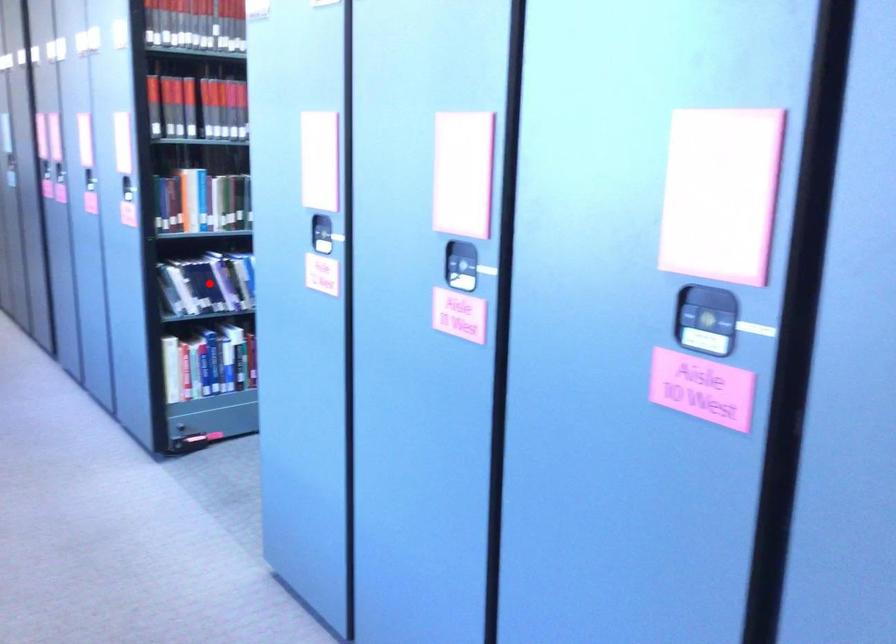
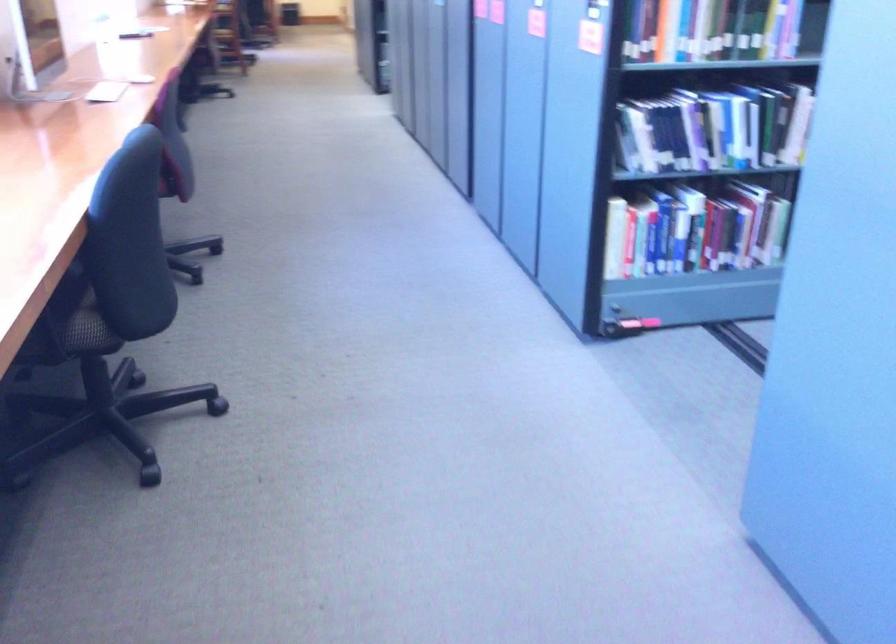
Question: I am providing you with two images of the same scene from different viewpoints. In image1, a red point is highlighted. Considering the same 3D point in image2, which of the following is correct?

Choices:
 (A) It is closer
 (B) It is farther

Answer: (A)